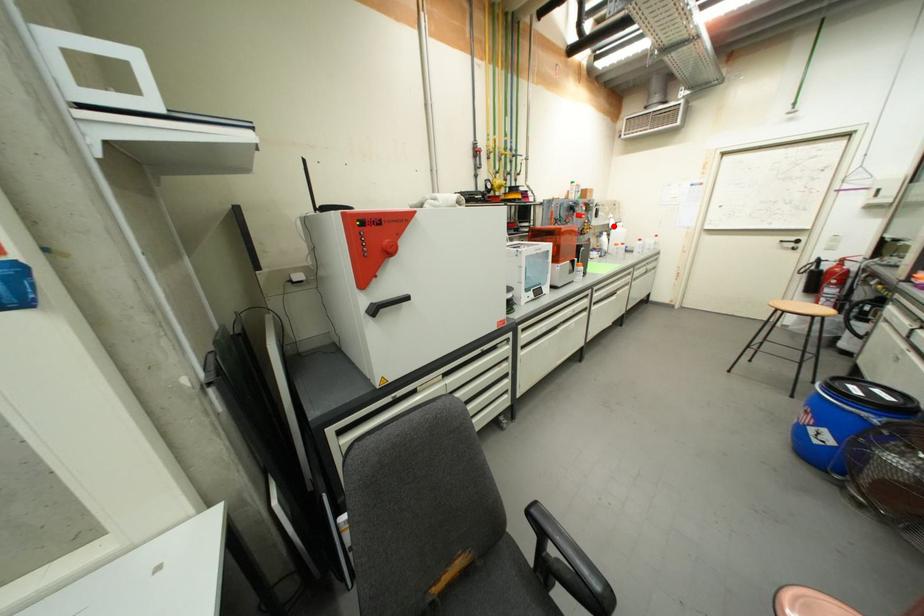
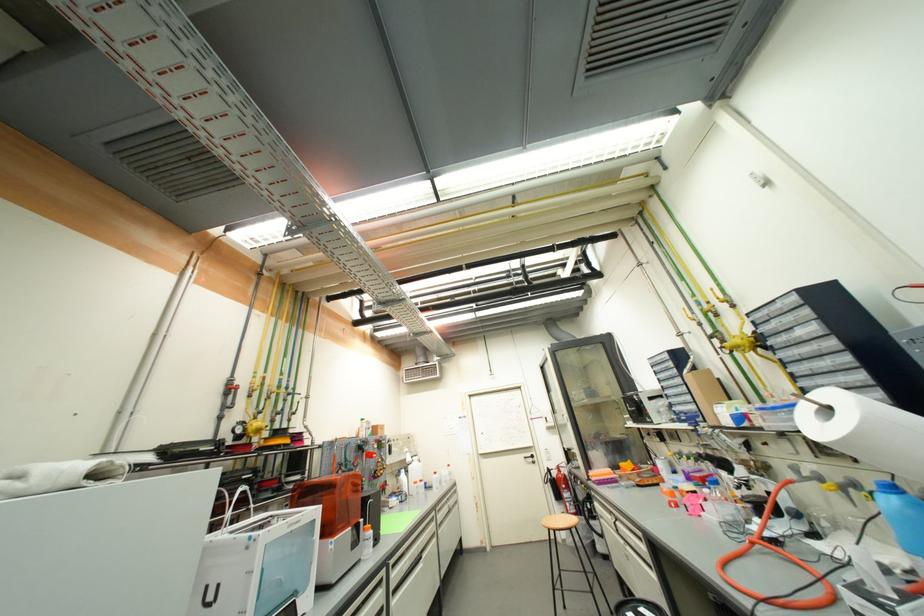
Question: I am providing you with two images of the same scene from different viewpoints. In image1, a red point is highlighted. Considering the same 3D point in image2, which of the following is correct?

Choices:
 (A) It is closer
 (B) It is farther

Answer: (B)